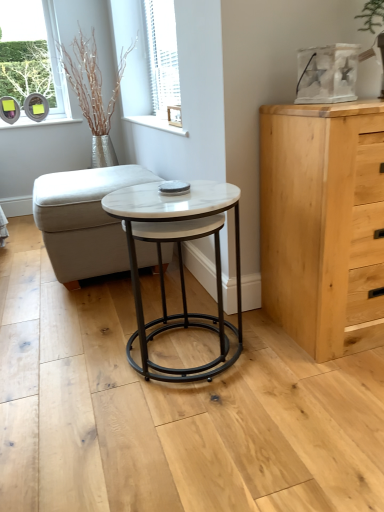
The image size is (384, 512). In order to click on free space between white marble coffee table at center and light wood chest of drawers at right in this screenshot , I will do 269,343.